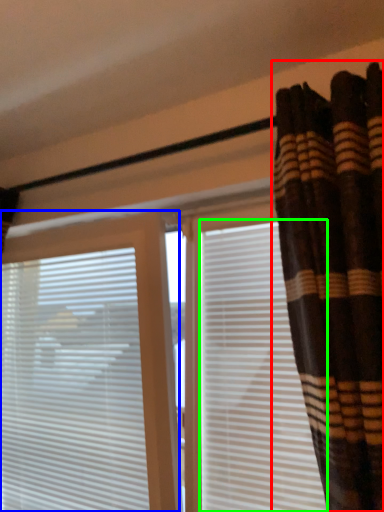
Question: Which is nearer to the curtain (highlighted by a red box)? window blind (highlighted by a blue box) or shutter (highlighted by a green box).

Choices:
 (A) window blind
 (B) shutter

Answer: (B)